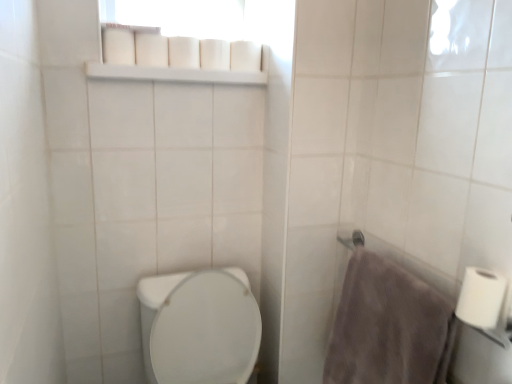
Question: In terms of height, does gray fluffy towel at right look taller or shorter compared to white plastic shelf at upper center?

Choices:
 (A) tall
 (B) short

Answer: (A)

Question: From the image's perspective, relative to white plastic shelf at upper center, is gray fluffy towel at right above or below?

Choices:
 (A) above
 (B) below

Answer: (B)

Question: Estimate the real-world distances between objects in this image. Which object is closer to the white matte toilet paper at upper center, the 3th toilet paper when ordered from bottom to top?

Choices:
 (A) white matte toilet paper at right, which appears as the 1th toilet paper when ordered from the bottom
 (B) white plastic shelf at upper center
 (C) white matte toilet paper at upper center, the 2th toilet paper in the top-to-bottom sequence
 (D) gray fluffy towel at right
 (E) white glossy toilet at lower left

Answer: (B)

Question: Estimate the real-world distances between objects in this image. Which object is farther from the white matte toilet paper at upper center, the 3th toilet paper when ordered from bottom to top?

Choices:
 (A) gray fluffy towel at right
 (B) white glossy toilet at lower left
 (C) white matte toilet paper at upper center, acting as the second toilet paper starting from the back
 (D) white plastic shelf at upper center
 (E) white matte toilet paper at right, which appears as the 1th toilet paper when ordered from the bottom

Answer: (E)